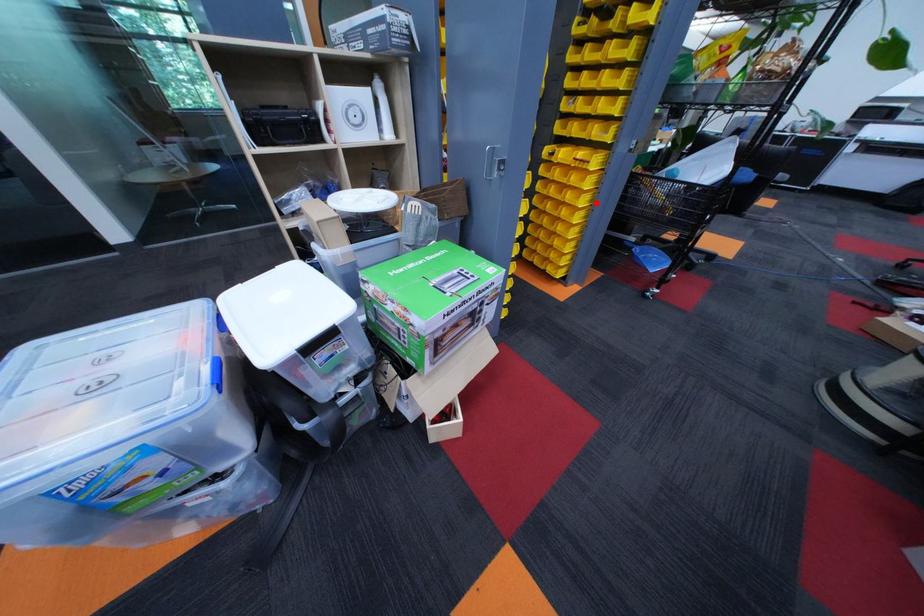
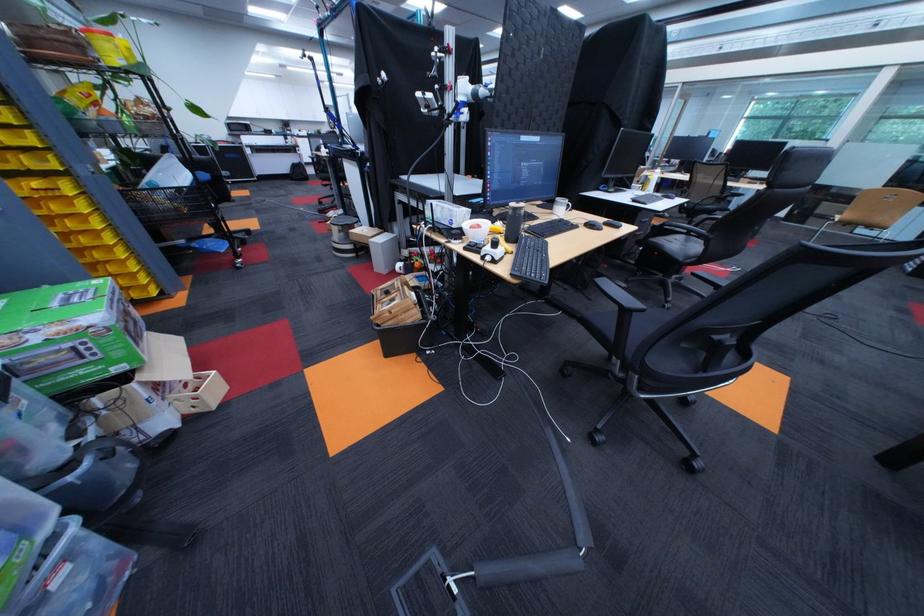
The point at the highlighted location is marked in the first image. Where is the corresponding point in the second image?

(111, 225)